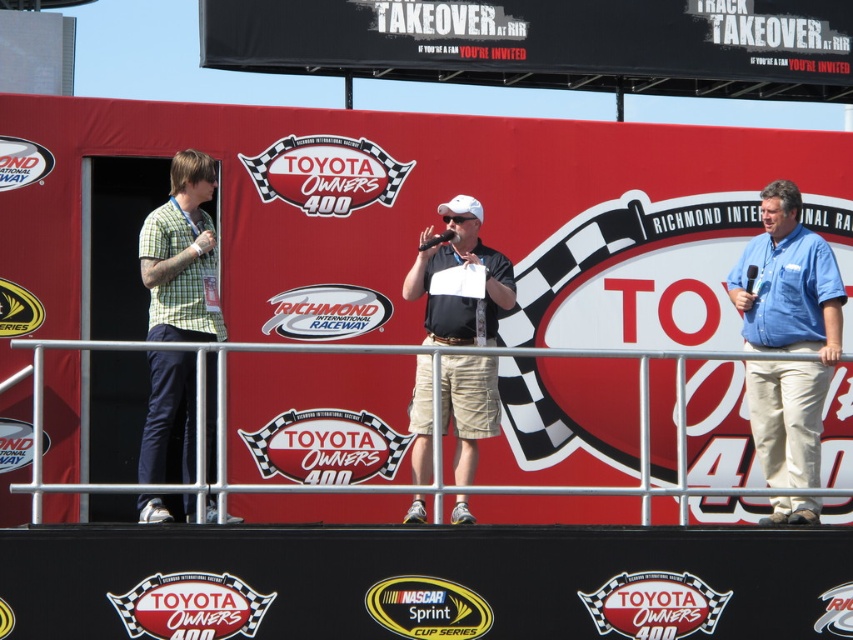
Question: Which object is the closest to the green checkered shirt at left?

Choices:
 (A) blue shirt at right
 (B) metal at center

Answer: (B)

Question: Among these objects, which one is nearest to the camera?

Choices:
 (A) metal at center
 (B) blue shirt at right
 (C) green checkered shirt at left

Answer: (A)

Question: Among these objects, which one is nearest to the camera?

Choices:
 (A) metal at center
 (B) blue shirt at right
 (C) matte black shirt at center

Answer: (A)

Question: Is green checkered shirt at left further to camera compared to matte black shirt at center?

Choices:
 (A) yes
 (B) no

Answer: (B)

Question: Can you confirm if blue shirt at right is positioned to the left of metal at center?

Choices:
 (A) no
 (B) yes

Answer: (A)

Question: Does blue shirt at right have a larger size compared to green checkered shirt at left?

Choices:
 (A) no
 (B) yes

Answer: (B)